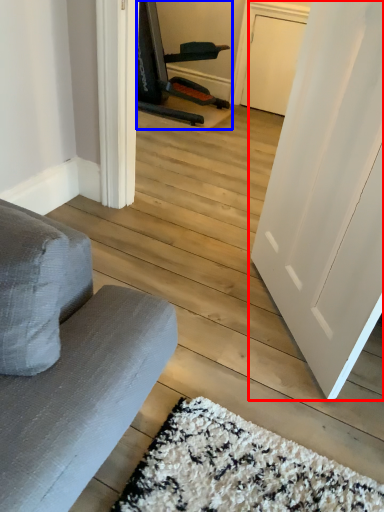
Question: Which point is closer to the camera, door (highlighted by a red box) or armchair (highlighted by a blue box)?

Choices:
 (A) door
 (B) armchair

Answer: (A)